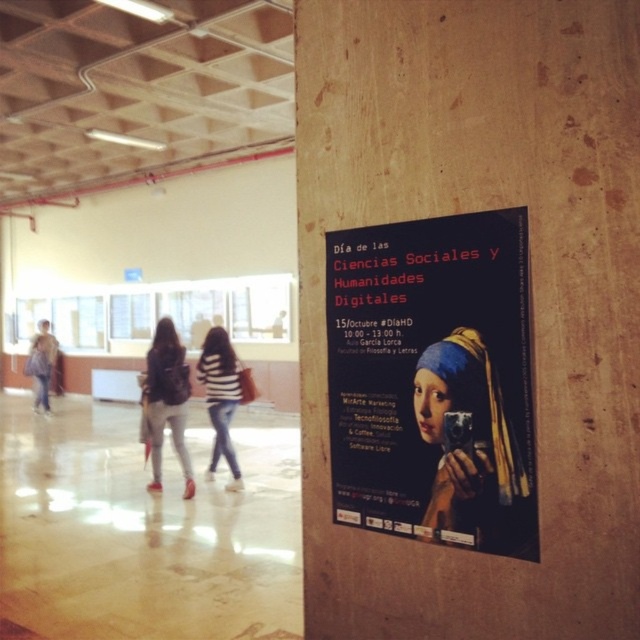
Question: Does black matte poster at center appear on the right side of striped fabric sweater at center?

Choices:
 (A) yes
 (B) no

Answer: (A)

Question: Estimate the real-world distances between objects in this image. Which object is closer to the striped fabric sweater at center?

Choices:
 (A) black matte poster at center
 (B) light brown fabric pants at center

Answer: (B)

Question: Which point is closer to the camera?

Choices:
 (A) (461, 449)
 (B) (205, 348)
 (C) (145, 412)

Answer: (A)

Question: Can you confirm if black matte poster at center is bigger than striped fabric sweater at center?

Choices:
 (A) no
 (B) yes

Answer: (A)

Question: Among these objects, which one is farthest from the camera?

Choices:
 (A) light brown fabric pants at center
 (B) striped fabric sweater at center

Answer: (B)

Question: Considering the relative positions of light brown fabric pants at center and striped fabric sweater at center in the image provided, where is light brown fabric pants at center located with respect to striped fabric sweater at center?

Choices:
 (A) left
 (B) right

Answer: (A)